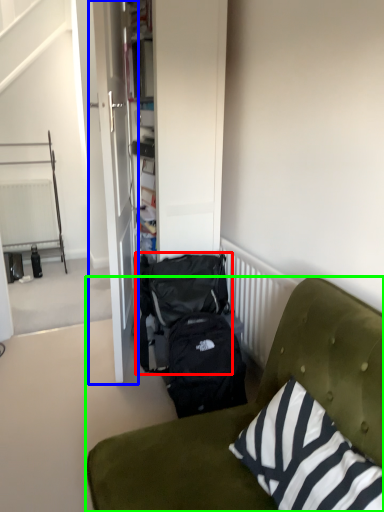
Question: Which is nearer to the backpack (highlighted by a red box)? door (highlighted by a blue box) or studio couch (highlighted by a green box).

Choices:
 (A) door
 (B) studio couch

Answer: (A)